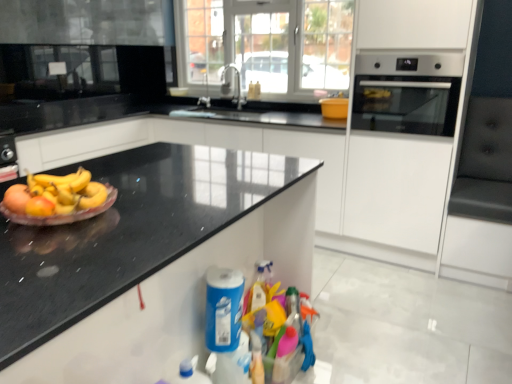
What is the approximate height of transparent glass door at center?

It is 34.35 inches.

The image size is (512, 384). What do you see at coordinates (127, 233) in the screenshot? I see `black granite countertop at left` at bounding box center [127, 233].

The height and width of the screenshot is (384, 512). What do you see at coordinates (407, 92) in the screenshot?
I see `satin silver oven at right` at bounding box center [407, 92].

This screenshot has height=384, width=512. Identify the location of transparent glass door at center. (266, 46).

Considering the relative sizes of translucent plastic plate at left and satin nickel faucet at center in the image provided, is translucent plastic plate at left smaller than satin nickel faucet at center?

Yes.

Consider the image. Could satin nickel faucet at center be considered to be inside translucent plastic plate at left?

Definitely not — satin nickel faucet at center is not inside translucent plastic plate at left.

Can you confirm if translucent plastic plate at left is positioned to the left of satin nickel faucet at center?

Indeed, translucent plastic plate at left is positioned on the left side of satin nickel faucet at center.

From the image's perspective, is translucent plastic plate at left positioned above or below satin nickel faucet at center?

Based on their image positions, translucent plastic plate at left is located beneath satin nickel faucet at center.

Is silver metallic faucet at upper center wider than translucent plastic plate at left?

In fact, silver metallic faucet at upper center might be narrower than translucent plastic plate at left.

From the image's perspective, between silver metallic faucet at upper center and translucent plastic plate at left, which one is located above?

silver metallic faucet at upper center is shown above in the image.

Is silver metallic faucet at upper center in front of translucent plastic plate at left?

No, silver metallic faucet at upper center is further to the viewer.

Is silver metallic faucet at upper center next to translucent plastic plate at left and touching it?

silver metallic faucet at upper center is not next to translucent plastic plate at left, and they're not touching.

What are the coordinates of `countertop located below the satin nickel faucet at center (from the image's perspective)` in the screenshot? It's located at (127, 233).

From the image's perspective, between black granite countertop at left and satin nickel faucet at center, who is located below?

black granite countertop at left is shown below in the image.

How different are the orientations of black granite countertop at left and satin nickel faucet at center in degrees?

The angle between the facing direction of black granite countertop at left and the facing direction of satin nickel faucet at center is 89.3 degrees.

Is black granite countertop at left looking in the opposite direction of satin nickel faucet at center?

No, black granite countertop at left is not facing away from satin nickel faucet at center.

Considering the positions of objects black granite countertop at left and satin silver oven at right in the image provided, who is more to the right, black granite countertop at left or satin silver oven at right?

satin silver oven at right is more to the right.

From a real-world perspective, does black granite countertop at left sit lower than satin silver oven at right?

Yes.

Can you confirm if black granite countertop at left is bigger than satin silver oven at right?

Yes, black granite countertop at left is bigger than satin silver oven at right.

Is transparent glass door at center in front of satin nickel faucet at center?

Yes, it is.

Which is nearer, (x=331, y=34) or (x=225, y=70)?

Clearly, point (x=331, y=34) is closer to the camera than point (x=225, y=70).

Locate an element on the screen. This screenshot has width=512, height=384. glass door above the satin nickel faucet at center (from the image's perspective) is located at coordinates (266, 46).

Are silver metallic faucet at upper center and black granite countertop at left far apart?

silver metallic faucet at upper center is positioned a significant distance from black granite countertop at left.

From a real-world perspective, who is located lower, silver metallic faucet at upper center or black granite countertop at left?

From a 3D spatial view, black granite countertop at left is below.

Is silver metallic faucet at upper center turned away from black granite countertop at left?

No.

Considering the positions of objects silver metallic faucet at upper center and black granite countertop at left in the image provided, who is more to the right, silver metallic faucet at upper center or black granite countertop at left?

From the viewer's perspective, black granite countertop at left appears more on the right side.

Looking at this image, which object is further away from the camera taking this photo, transparent glass door at center or translucent plastic plate at left?

transparent glass door at center.

Considering the positions of objects transparent glass door at center and translucent plastic plate at left in the image provided, who is more to the left, transparent glass door at center or translucent plastic plate at left?

From the viewer's perspective, translucent plastic plate at left appears more on the left side.

From the image's perspective, is transparent glass door at center on top of translucent plastic plate at left?

Yes, from the image's perspective, transparent glass door at center is over translucent plastic plate at left.

Could you tell me if transparent glass door at center is facing translucent plastic plate at left?

Yes.

At what (x,y) coordinates should I click in order to perform the action: click on tap above the translucent plastic plate at left (from the image's perspective). Please return your answer as a coordinate pair (x, y). Looking at the image, I should click on (237, 83).

Find the location of a particular element. paper plate on the left of the silver metallic faucet at upper center is located at coordinates (61, 215).

When comparing their distances from black granite countertop at left, does blue plastic cleaning product at lower center or satin nickel faucet at center seem further?

satin nickel faucet at center is further to black granite countertop at left.

When comparing their distances from transparent glass door at center, does black granite countertop at left or blue plastic cleaning product at lower center seem closer?

Among the two, black granite countertop at left is located nearer to transparent glass door at center.

When comparing their distances from translucent plastic plate at left, does black granite countertop at left or transparent glass door at center seem further?

transparent glass door at center lies further to translucent plastic plate at left than the other object.

Which object lies nearer to the anchor point silver metallic faucet at upper center, black granite countertop at left or satin nickel faucet at center?

satin nickel faucet at center lies closer to silver metallic faucet at upper center than the other object.

When comparing their distances from satin silver oven at right, does silver metallic faucet at upper center or blue plastic cleaning product at lower center seem closer?

blue plastic cleaning product at lower center is closer to satin silver oven at right.

Estimate the real-world distances between objects in this image. Which object is further from silver metallic faucet at upper center, satin silver oven at right or black granite countertop at left?

black granite countertop at left is positioned further to the anchor silver metallic faucet at upper center.

From the image, which object appears to be farther from black granite countertop at left, blue plastic cleaning product at lower center or transparent glass door at center?

transparent glass door at center is positioned further to the anchor black granite countertop at left.

Based on their spatial positions, is translucent plastic plate at left or satin silver oven at right further from satin nickel faucet at center?

translucent plastic plate at left is positioned further to the anchor satin nickel faucet at center.

Locate an element on the screen. This screenshot has height=384, width=512. home appliance between translucent plastic plate at left and transparent glass door at center in the front-back direction is located at coordinates (407, 92).

You are a GUI agent. You are given a task and a screenshot of the screen. Output one action in this format:
    pyautogui.click(x=<x>, y=<y>)
    Task: Click on the cleaning product between translucent plastic plate at left and satin silver oven at right from left to right
    
    Given the screenshot: What is the action you would take?
    pyautogui.click(x=225, y=324)

In order to click on paper plate located between black granite countertop at left and blue plastic cleaning product at lower center in the depth direction in this screenshot , I will do `click(61, 215)`.

Where is `glass door situated between silver metallic faucet at upper center and satin silver oven at right from left to right`? Image resolution: width=512 pixels, height=384 pixels. glass door situated between silver metallic faucet at upper center and satin silver oven at right from left to right is located at coordinates (266, 46).